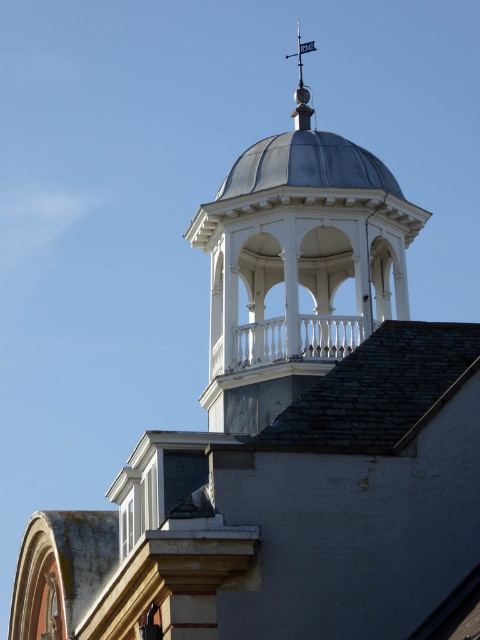
You are an architect examining the building and want to install a new light fixture between the white wood bell tower at upper center and the polished silver spire at upper center. Based on their positions, which object will the light fixture be closer to?

The white wood bell tower at upper center is closer to the viewer than the polished silver spire at upper center, so the light fixture will be closer to the white wood bell tower at upper center.